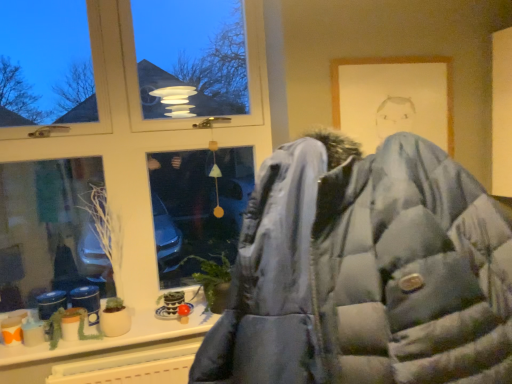
Locate an element on the screen. Image resolution: width=512 pixels, height=384 pixels. free space above yellow plastic radiator at lower center (from a real-world perspective) is located at coordinates (123, 350).